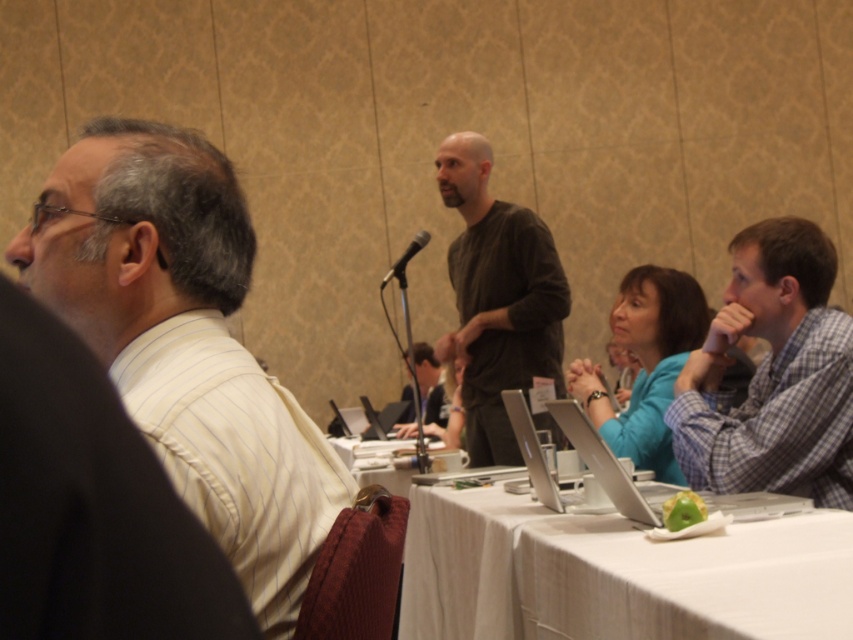
Consider the image. You are a photographer positioned at the back of the room. You want to take a photo of the white striped shirt at left and the silver metallic laptop at center. Which object should you focus on first if you want to capture both in a single shot without moving the camera?

The white striped shirt at left is located above the silver metallic laptop at center, so you should focus on the white striped shirt at left first to ensure both are in focus since it is closer to the camera.

You are a photographer trying to capture a candid shot of the blue plaid shirt at right and the silver metallic laptop at center. Since you want to ensure both subjects are in focus, which object should you prioritize positioning closer to the camera to maintain clarity?

The blue plaid shirt at right has a lesser width compared to the silver metallic laptop at center. To keep both in focus, prioritize positioning the narrower blue plaid shirt at right closer to the camera since it requires less depth of field.